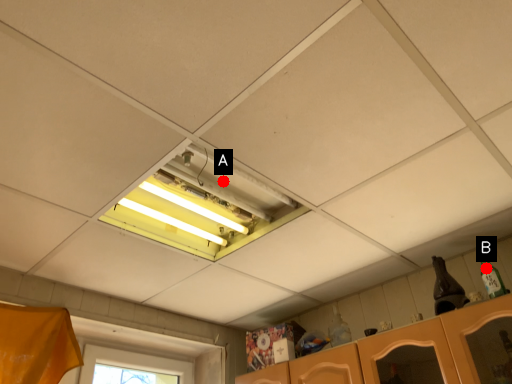
Question: Two points are circled on the image, labeled by A and B beside each circle. Which point is farther to the camera?

Choices:
 (A) A is further
 (B) B is further

Answer: (B)